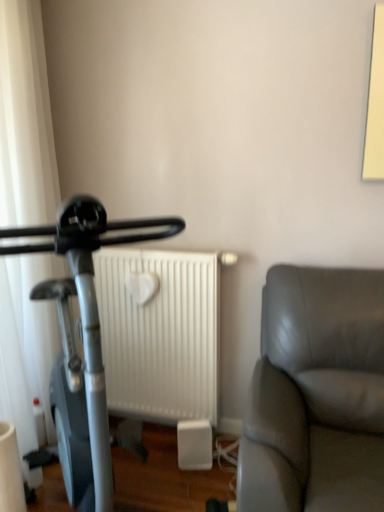
Describe the element at coordinates (25, 120) in the screenshot. I see `white sheer curtain at left` at that location.

Find the location of a particular element. Image resolution: width=384 pixels, height=512 pixels. silver metallic stationary bicycle at left is located at coordinates (88, 309).

Locate an element on the screen. white matte radiator at center is located at coordinates (161, 334).

Is white matte radiator at center next to silver metallic stationary bicycle at left and touching it?

white matte radiator at center is not next to silver metallic stationary bicycle at left, and they're not touching.

Is point (167, 290) closer to viewer compared to point (20, 231)?

No.

What's the angular difference between white matte radiator at center and silver metallic stationary bicycle at left's facing directions?

They differ by 40.4 degrees in their facing directions.

Between white matte radiator at center and silver metallic stationary bicycle at left, which one has less height?

white matte radiator at center is shorter.

Is white sheer curtain at left facing away from white matte radiator at center?

No, white sheer curtain at left's orientation is not away from white matte radiator at center.

Does white sheer curtain at left appear on the right side of white matte radiator at center?

No.

From the image's perspective, between white sheer curtain at left and white matte radiator at center, which one is located above?

white sheer curtain at left is shown above in the image.

What's the angular difference between silver metallic stationary bicycle at left and white sheer curtain at left's facing directions?

The facing directions of silver metallic stationary bicycle at left and white sheer curtain at left are 49.3 degrees apart.

From the image's perspective, which is above, silver metallic stationary bicycle at left or white sheer curtain at left?

From the image's view, white sheer curtain at left is above.

Which point is more distant from viewer, [95,502] or [26,194]?

The point [26,194] is behind.

This screenshot has width=384, height=512. Identify the location of curtain above the silver metallic stationary bicycle at left (from a real-world perspective). [x=25, y=120].

Is the position of white matte radiator at center less distant than that of white sheer curtain at left?

That is False.

From the picture: Who is smaller, white matte radiator at center or white sheer curtain at left?

With smaller size is white matte radiator at center.

At what (x,y) coordinates should I click in order to perform the action: click on radiator below the white sheer curtain at left (from a real-world perspective). Please return your answer as a coordinate pair (x, y). This screenshot has width=384, height=512. Looking at the image, I should click on (161, 334).

In terms of width, does white matte radiator at center look wider or thinner when compared to white sheer curtain at left?

Clearly, white matte radiator at center has less width compared to white sheer curtain at left.

Can you confirm if white sheer curtain at left is taller than silver metallic stationary bicycle at left?

Yes, white sheer curtain at left is taller than silver metallic stationary bicycle at left.

What's the angular difference between white sheer curtain at left and silver metallic stationary bicycle at left's facing directions?

There is a 49.3-degree angle between the facing directions of white sheer curtain at left and silver metallic stationary bicycle at left.

Is white sheer curtain at left turned away from silver metallic stationary bicycle at left?

white sheer curtain at left is not turned away from silver metallic stationary bicycle at left.

Is white sheer curtain at left beside silver metallic stationary bicycle at left?

No, white sheer curtain at left is not making contact with silver metallic stationary bicycle at left.

From the image's perspective, is silver metallic stationary bicycle at left located above or below white matte radiator at center?

silver metallic stationary bicycle at left is below white matte radiator at center.

Considering the positions of objects silver metallic stationary bicycle at left and white matte radiator at center in the image provided, who is in front, silver metallic stationary bicycle at left or white matte radiator at center?

Positioned in front is silver metallic stationary bicycle at left.

Can you confirm if silver metallic stationary bicycle at left is smaller than white matte radiator at center?

Actually, silver metallic stationary bicycle at left might be larger than white matte radiator at center.

How different are the orientations of silver metallic stationary bicycle at left and white matte radiator at center in degrees?

The facing directions of silver metallic stationary bicycle at left and white matte radiator at center are 40.4 degrees apart.

Locate an element on the screen. This screenshot has height=512, width=384. radiator directly beneath the silver metallic stationary bicycle at left (from a real-world perspective) is located at coordinates (161, 334).

At what (x,y) coordinates should I click in order to perform the action: click on curtain in front of the white matte radiator at center. Please return your answer as a coordinate pair (x, y). Image resolution: width=384 pixels, height=512 pixels. Looking at the image, I should click on (25, 120).

Looking at the image, which one is located closer to silver metallic stationary bicycle at left, white matte radiator at center or white sheer curtain at left?

white sheer curtain at left is closer to silver metallic stationary bicycle at left.

Estimate the real-world distances between objects in this image. Which object is further from white matte radiator at center, white sheer curtain at left or silver metallic stationary bicycle at left?

silver metallic stationary bicycle at left is further to white matte radiator at center.

Estimate the real-world distances between objects in this image. Which object is further from white sheer curtain at left, white matte radiator at center or silver metallic stationary bicycle at left?

white matte radiator at center is positioned further to the anchor white sheer curtain at left.

When comparing their distances from silver metallic stationary bicycle at left, does white sheer curtain at left or white matte radiator at center seem closer?

white sheer curtain at left.

Estimate the real-world distances between objects in this image. Which object is closer to white matte radiator at center, silver metallic stationary bicycle at left or white sheer curtain at left?

white sheer curtain at left is closer to white matte radiator at center.

Looking at the image, which one is located closer to white sheer curtain at left, silver metallic stationary bicycle at left or white matte radiator at center?

silver metallic stationary bicycle at left is closer to white sheer curtain at left.

This screenshot has height=512, width=384. In order to click on curtain positioned between silver metallic stationary bicycle at left and white matte radiator at center from near to far in this screenshot , I will do `click(25, 120)`.